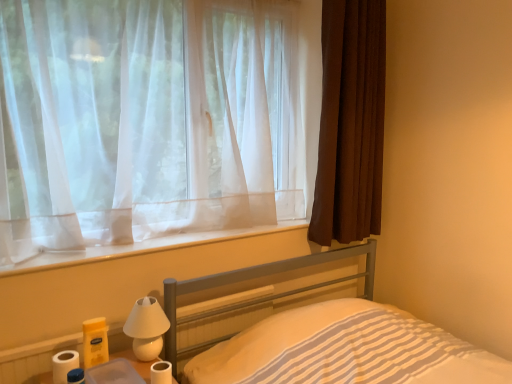
Question: Is metallic gray bed at lower center in front of or behind brown textured curtain at right, acting as the second curtain starting from the left, in the image?

Choices:
 (A) behind
 (B) front

Answer: (B)

Question: Looking at their shapes, would you say metallic gray bed at lower center is wider or thinner than brown textured curtain at right, acting as the second curtain starting from the left?

Choices:
 (A) wide
 (B) thin

Answer: (A)

Question: Which is nearer to the white matte bedside lamp at lower left?

Choices:
 (A) metallic gray bed at lower center
 (B) brown textured curtain at right, acting as the second curtain starting from the left
 (C) clear plastic container at lower left
 (D) white matte toilet paper at lower left, arranged as the 1th toilet paper when viewed from the left
 (E) white sheer curtain at upper left

Answer: (C)

Question: Based on their relative distances, which object is farther from the sheer white curtain at upper left, the second curtain when ordered from right to left?

Choices:
 (A) white sheer curtain at upper left
 (B) white matte toilet paper at lower left, arranged as the 1th toilet paper when viewed from the left
 (C) white matte bedside lamp at lower left
 (D) clear plastic container at lower left
 (E) brown textured curtain at right, acting as the second curtain starting from the left

Answer: (B)